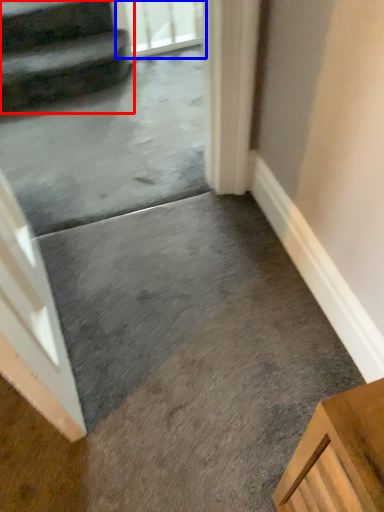
Question: Which point is further to the camera, stairs (highlighted by a red box) or screen door (highlighted by a blue box)?

Choices:
 (A) stairs
 (B) screen door

Answer: (B)